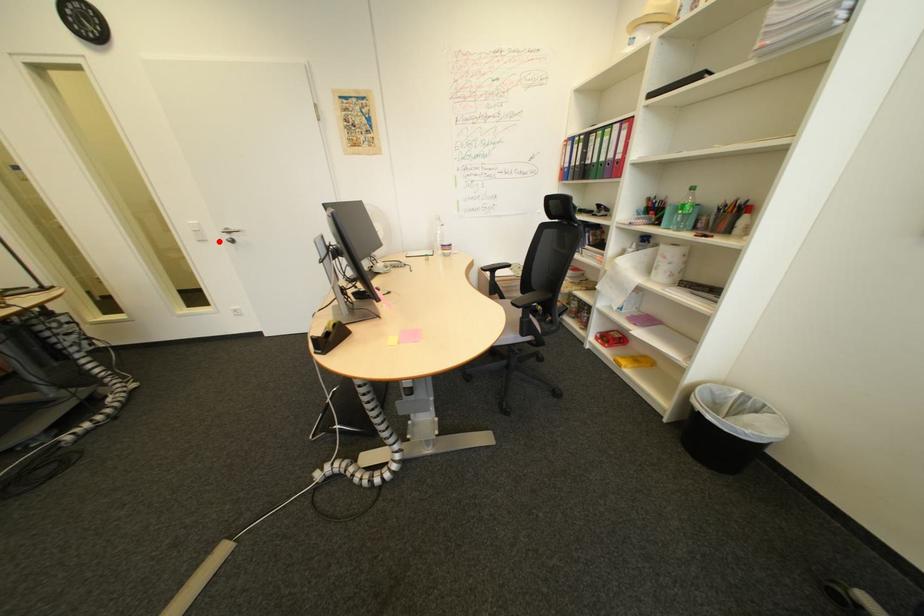
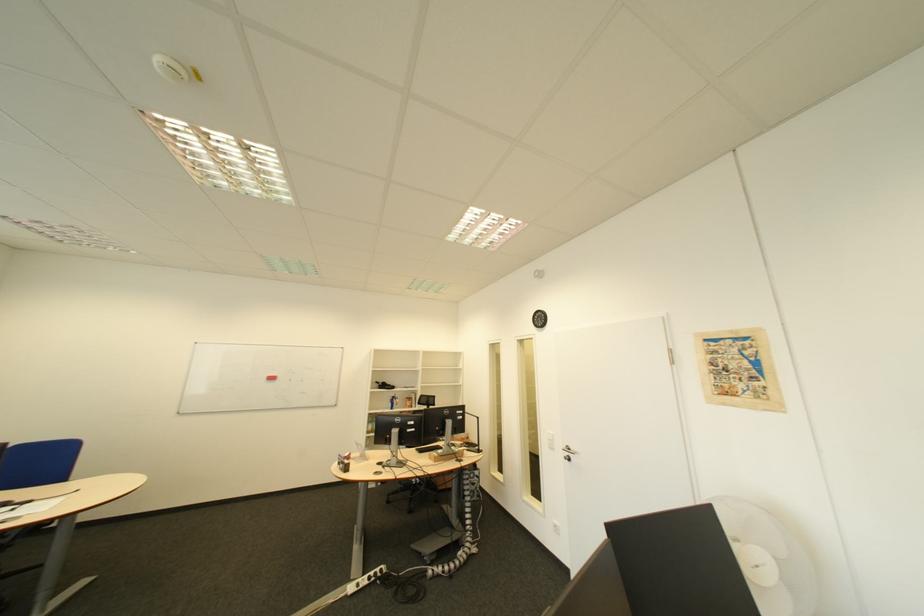
Question: I am providing you with two images of the same scene from different viewpoints. Given a red point in image1, look at the same physical point in image2. Is it:

Choices:
 (A) Closer to the viewpoint
 (B) Farther from the viewpoint

Answer: (B)